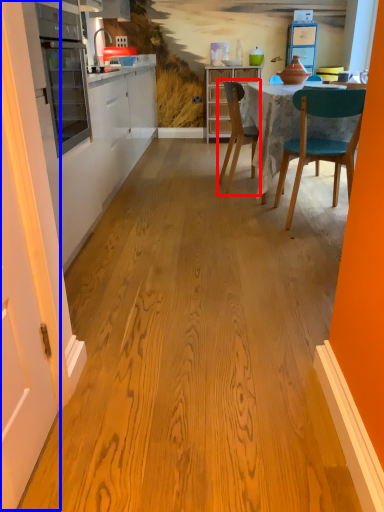
Question: Which of the following is the farthest to the observer, chair (highlighted by a red box) or door (highlighted by a blue box)?

Choices:
 (A) chair
 (B) door

Answer: (A)